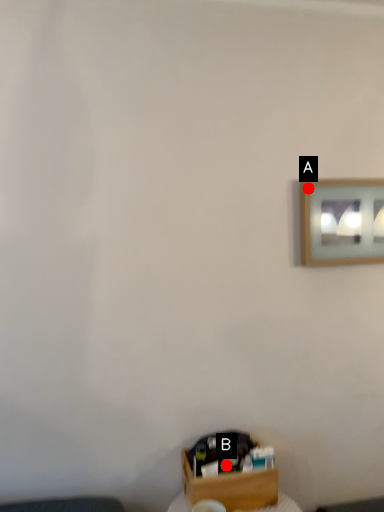
Question: Two points are circled on the image, labeled by A and B beside each circle. Which point is farther from the camera taking this photo?

Choices:
 (A) A is further
 (B) B is further

Answer: (A)